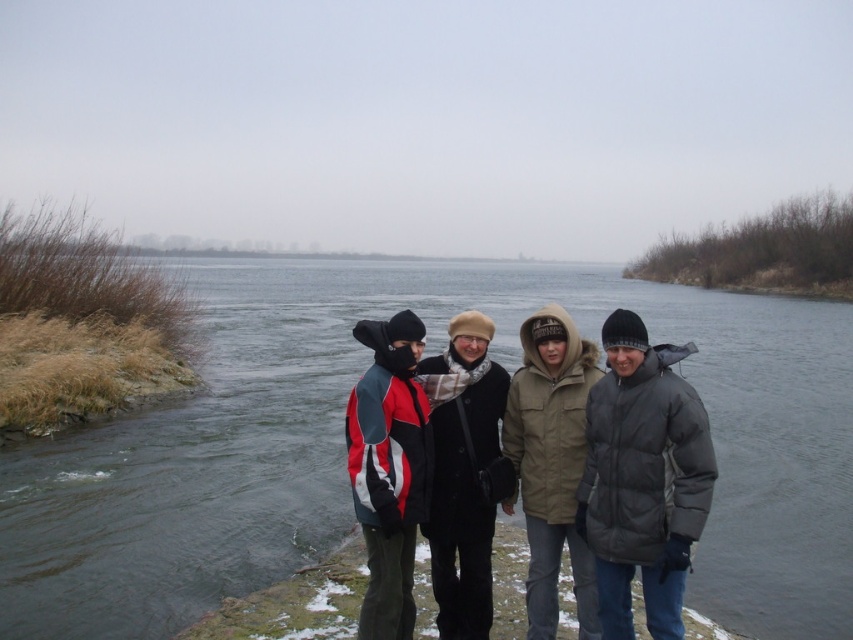
Question: Which of the following is the closest to the observer?

Choices:
 (A) greenish water at center
 (B) khaki woolen coat at center

Answer: (A)

Question: Estimate the real-world distances between objects in this image. Which object is farther from the black wool coat at center?

Choices:
 (A) greenish water at center
 (B) red and gray jacket at center
 (C) khaki woolen coat at center

Answer: (A)

Question: Is gray down jacket at center smaller than khaki woolen coat at center?

Choices:
 (A) yes
 (B) no

Answer: (A)

Question: Is gray down jacket at center closer to camera compared to red and gray jacket at center?

Choices:
 (A) yes
 (B) no

Answer: (A)

Question: Which object is closer to the camera taking this photo?

Choices:
 (A) khaki woolen coat at center
 (B) red and gray jacket at center
 (C) gray down jacket at center
 (D) greenish water at center

Answer: (C)

Question: Is red and gray jacket at center closer to the viewer compared to black wool coat at center?

Choices:
 (A) no
 (B) yes

Answer: (B)